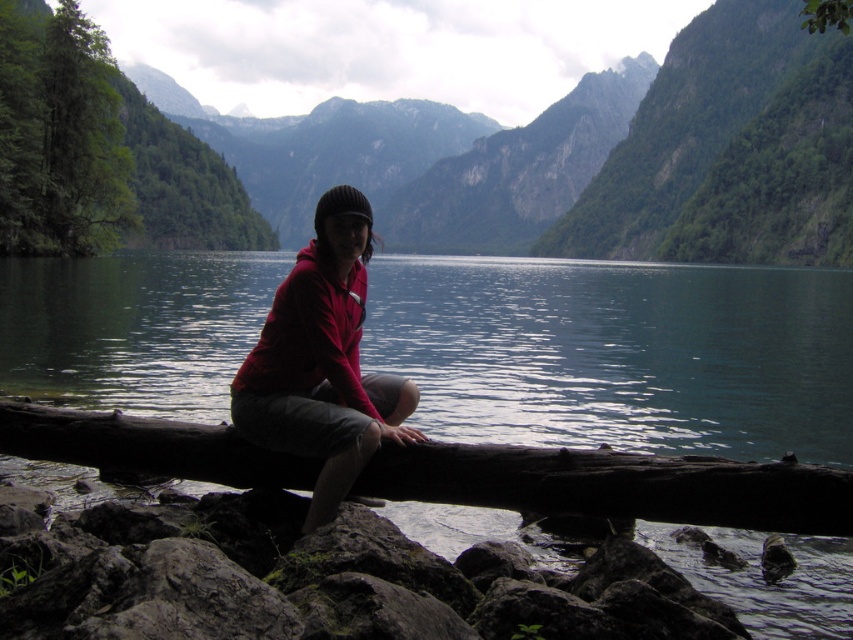
Measure the distance from matte red hoodie at center to green leafy tree at left.

287.65 feet

Is point (357, 253) in front of point (10, 60)?

Yes.

The height and width of the screenshot is (640, 853). Identify the location of matte red hoodie at center. (322, 362).

In the scene shown: Is greenish-blue water at center below dark brown wood log at center?

No, greenish-blue water at center is not below dark brown wood log at center.

Can you confirm if greenish-blue water at center is smaller than dark brown wood log at center?

No, greenish-blue water at center is not smaller than dark brown wood log at center.

Between point (795, 291) and point (460, 476), which one is positioned behind?

Positioned behind is point (795, 291).

Find the location of a particular element. greenish-blue water at center is located at coordinates (621, 353).

Does greenish-blue water at center have a greater height compared to green leafy tree at left?

Incorrect, greenish-blue water at center's height is not larger of green leafy tree at left's.

Can you confirm if greenish-blue water at center is wider than green leafy tree at left?

A: Correct, the width of greenish-blue water at center exceeds that of green leafy tree at left.

Find the location of a particular element. greenish-blue water at center is located at coordinates (621, 353).